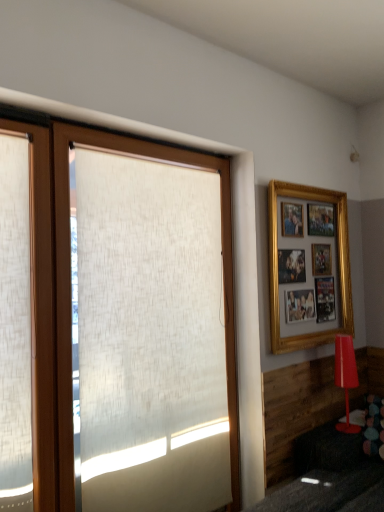
Question: From the image's perspective, is white textured roller blind at left located beneath wooden shutter at left?

Choices:
 (A) yes
 (B) no

Answer: (A)

Question: Are white textured roller blind at left and wooden shutter at left far apart?

Choices:
 (A) no
 (B) yes

Answer: (A)

Question: From a real-world perspective, is white textured roller blind at left positioned over wooden shutter at left based on gravity?

Choices:
 (A) yes
 (B) no

Answer: (B)

Question: Is white textured roller blind at left further to camera compared to wooden shutter at left?

Choices:
 (A) yes
 (B) no

Answer: (A)

Question: Is white textured roller blind at left completely or partially outside of wooden shutter at left?

Choices:
 (A) yes
 (B) no

Answer: (A)

Question: Considering the positions of gold/gilded picture frame at upper right and white textured roller blind at left in the image, is gold/gilded picture frame at upper right taller or shorter than white textured roller blind at left?

Choices:
 (A) tall
 (B) short

Answer: (B)

Question: Is point (274, 337) positioned closer to the camera than point (51, 321)?

Choices:
 (A) farther
 (B) closer

Answer: (A)

Question: Is gold/gilded picture frame at upper right wider or thinner than white textured roller blind at left?

Choices:
 (A) wide
 (B) thin

Answer: (A)

Question: From the image's perspective, relative to white textured roller blind at left, is gold/gilded picture frame at upper right above or below?

Choices:
 (A) above
 (B) below

Answer: (A)

Question: From the image's perspective, relative to gold/gilded picture frame at upper right, is white textured roller blind at left above or below?

Choices:
 (A) above
 (B) below

Answer: (B)

Question: Do you think white textured roller blind at left is within gold/gilded picture frame at upper right, or outside of it?

Choices:
 (A) outside
 (B) inside

Answer: (A)

Question: From a real-world perspective, is white textured roller blind at left above or below gold/gilded picture frame at upper right?

Choices:
 (A) above
 (B) below

Answer: (B)

Question: Is white textured roller blind at left taller or shorter than gold/gilded picture frame at upper right?

Choices:
 (A) short
 (B) tall

Answer: (B)

Question: Is gold/gilded picture frame at upper right in front of or behind wooden shutter at left in the image?

Choices:
 (A) behind
 (B) front

Answer: (A)

Question: Visually, is gold/gilded picture frame at upper right positioned to the left or to the right of wooden shutter at left?

Choices:
 (A) left
 (B) right

Answer: (B)